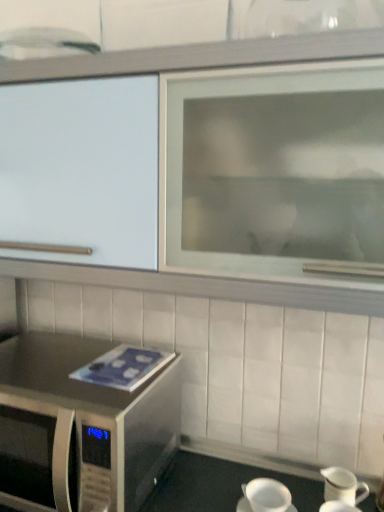
Question: From the image's perspective, is white matte coffee cup at lower center below white glossy pitcher at lower right, positioned as the second tableware in back-to-front order?

Choices:
 (A) no
 (B) yes

Answer: (A)

Question: Can you confirm if white matte coffee cup at lower center is thinner than white glossy pitcher at lower right, the 1th tableware positioned from the front?

Choices:
 (A) no
 (B) yes

Answer: (A)

Question: Can you confirm if white matte coffee cup at lower center is bigger than white glossy pitcher at lower right, positioned as the second tableware in back-to-front order?

Choices:
 (A) yes
 (B) no

Answer: (B)

Question: Can you confirm if white matte coffee cup at lower center is shorter than white glossy pitcher at lower right, the 1th tableware positioned from the front?

Choices:
 (A) no
 (B) yes

Answer: (B)

Question: Is white matte coffee cup at lower center to the left of white glossy pitcher at lower right, positioned as the second tableware in back-to-front order, from the viewer's perspective?

Choices:
 (A) yes
 (B) no

Answer: (A)

Question: Considering the relative sizes of white matte coffee cup at lower center and white glossy pitcher at lower right, the 1th tableware positioned from the front, in the image provided, is white matte coffee cup at lower center wider than white glossy pitcher at lower right, the 1th tableware positioned from the front,?

Choices:
 (A) no
 (B) yes

Answer: (B)

Question: Considering the relative sizes of white glossy pitcher at lower right, arranged as the 1th tableware when viewed from the back, and white glossy pitcher at lower right, positioned as the second tableware in back-to-front order, in the image provided, is white glossy pitcher at lower right, arranged as the 1th tableware when viewed from the back, shorter than white glossy pitcher at lower right, positioned as the second tableware in back-to-front order,?

Choices:
 (A) no
 (B) yes

Answer: (A)

Question: From the image's perspective, does white glossy pitcher at lower right, arranged as the 1th tableware when viewed from the back, appear lower than white glossy pitcher at lower right, the 1th tableware positioned from the front?

Choices:
 (A) no
 (B) yes

Answer: (A)

Question: From the image's perspective, is white glossy pitcher at lower right, positioned as the second tableware in front-to-back order, above white glossy pitcher at lower right, the 1th tableware positioned from the front?

Choices:
 (A) no
 (B) yes

Answer: (B)

Question: Is white glossy pitcher at lower right, positioned as the second tableware in front-to-back order, located outside white glossy pitcher at lower right, positioned as the second tableware in back-to-front order?

Choices:
 (A) no
 (B) yes

Answer: (B)

Question: Is white glossy pitcher at lower right, arranged as the 1th tableware when viewed from the back, thinner than white glossy pitcher at lower right, positioned as the second tableware in back-to-front order?

Choices:
 (A) yes
 (B) no

Answer: (A)

Question: From a real-world perspective, is white glossy pitcher at lower right, positioned as the second tableware in front-to-back order, on white glossy pitcher at lower right, the 1th tableware positioned from the front?

Choices:
 (A) yes
 (B) no

Answer: (A)

Question: Is white glossy cabinet at upper center to the right of white glossy pitcher at lower right, positioned as the second tableware in front-to-back order, from the viewer's perspective?

Choices:
 (A) yes
 (B) no

Answer: (B)